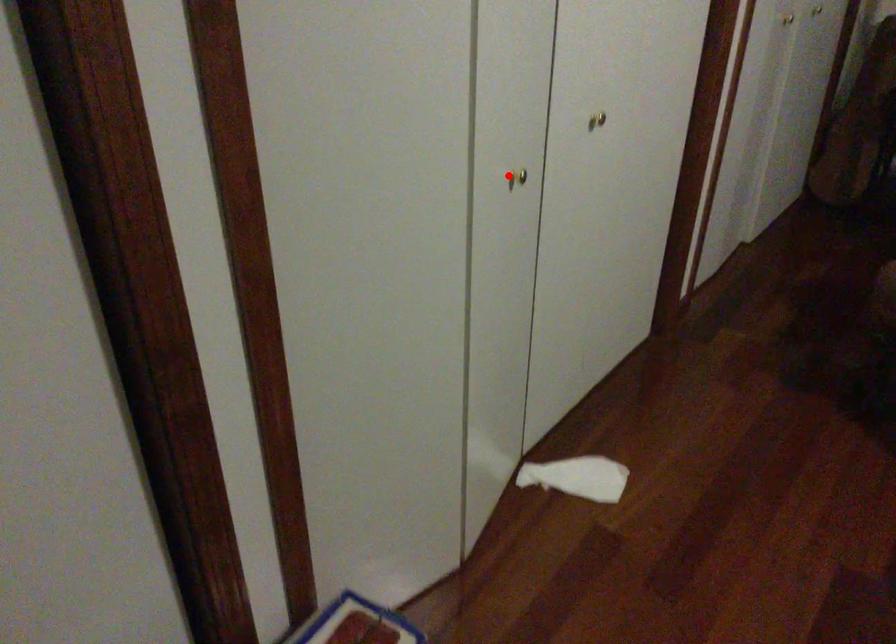
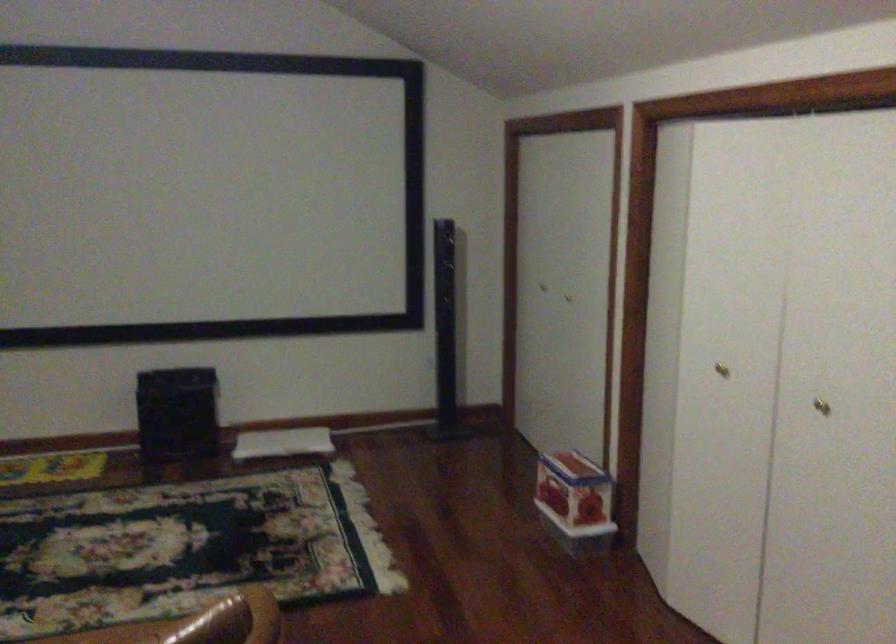
Find the pixel in the second image that matches the highlighted location in the first image.

(721, 368)